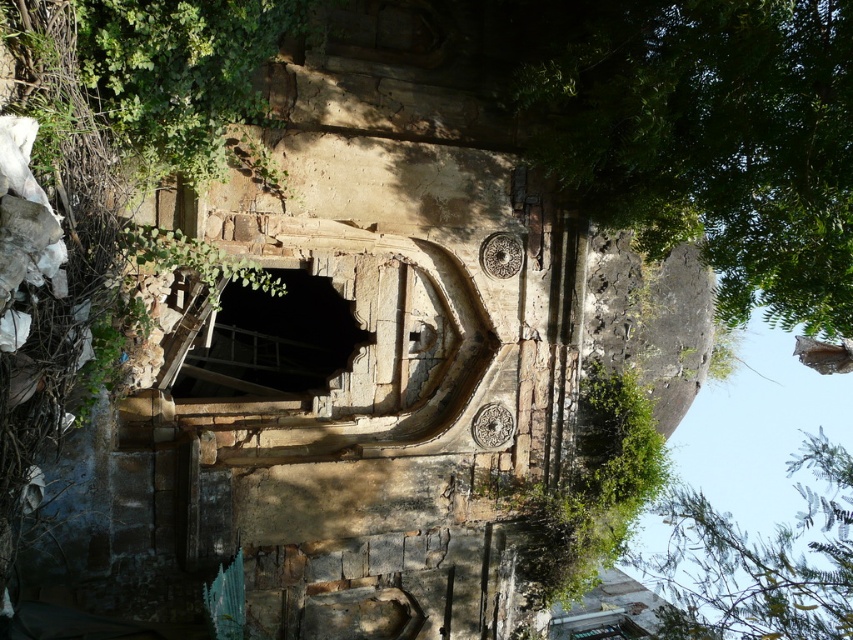
You are a hiker who has stumbled upon this historical ruin. You notice a green leafy tree at upper right and a dark stone hole at center. Which object is taller?

The green leafy tree at upper right is much taller than the dark stone hole at center.

You are standing in front of the aged stone structure and notice the green leafy tree at upper right. If you want to reach the tree without moving closer to the structure, which direction should you walk?

The green leafy tree at upper right is 95.27 feet away from the viewer, so you should walk towards the upper right direction to reach it without moving closer to the structure.